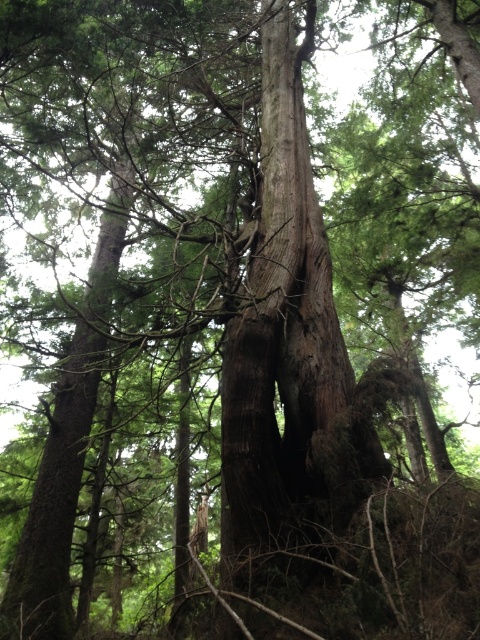
You are a hiker trying to identify the thickest part of the tree. Based on the scene, which object has a greater width between the smooth brown bark at center and the smooth brown tree trunk at center?

The smooth brown bark at center has a greater width than the smooth brown tree trunk at center according to the description.

In the forest scene, there are two objects at the center of the image, the smooth brown bark at center and the smooth brown tree trunk at center. Which one has a bigger size?

The smooth brown bark at center is larger in size than the smooth brown tree trunk at center.

You are a hiker standing in the forest and want to touch both the smooth brown bark at center and the smooth brown tree trunk at center. Which one should you reach for first to touch the one closer to you?

The smooth brown bark at center is closer to the viewer than the smooth brown tree trunk at center, so you should reach for the smooth brown bark at center first.